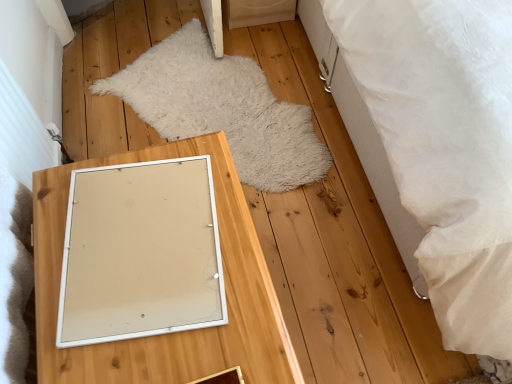
Find the location of `vacant area on top of wooden mirror at center (from a real-world perspective)`. vacant area on top of wooden mirror at center (from a real-world perspective) is located at coordinates (144, 251).